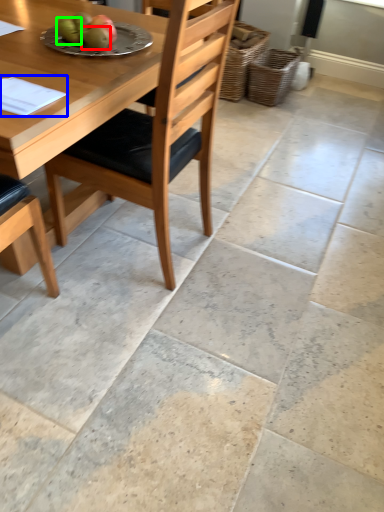
Question: Estimate the real-world distances between objects in this image. Which object is closer to fruit (highlighted by a red box), notepad (highlighted by a blue box) or fruit (highlighted by a green box)?

Choices:
 (A) notepad
 (B) fruit

Answer: (B)